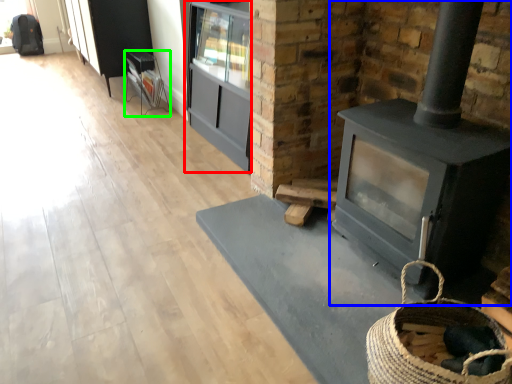
Question: Based on their relative distances, which object is nearer to entertainment center (highlighted by a red box)? Choose from wood burning stove (highlighted by a blue box) and furniture (highlighted by a green box).

Choices:
 (A) wood burning stove
 (B) furniture

Answer: (B)